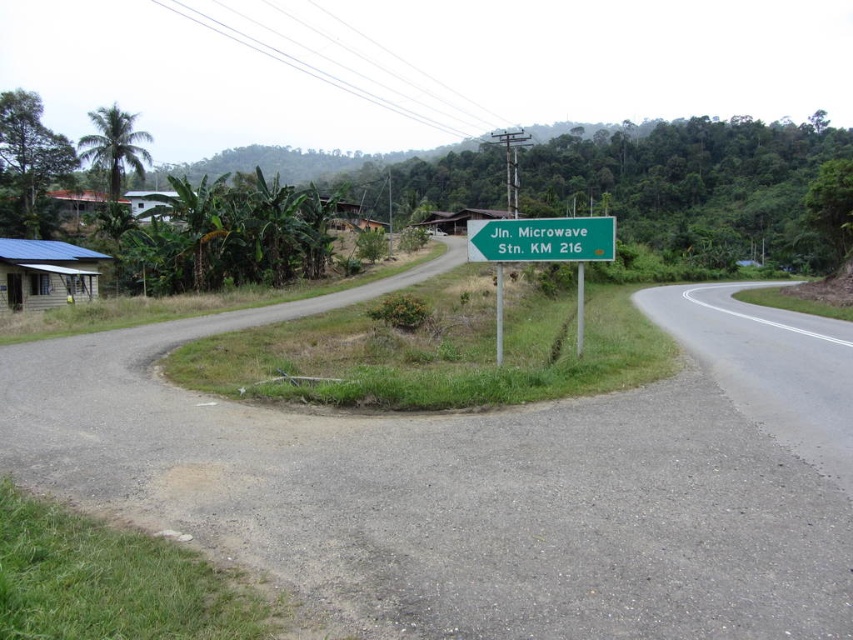
You are a delivery driver who needs to read the signs clearly. Which sign, the green plastic sign at center or the green metallic sign at center, is wider?

The green plastic sign at center is wider than the green metallic sign at center according to the description.